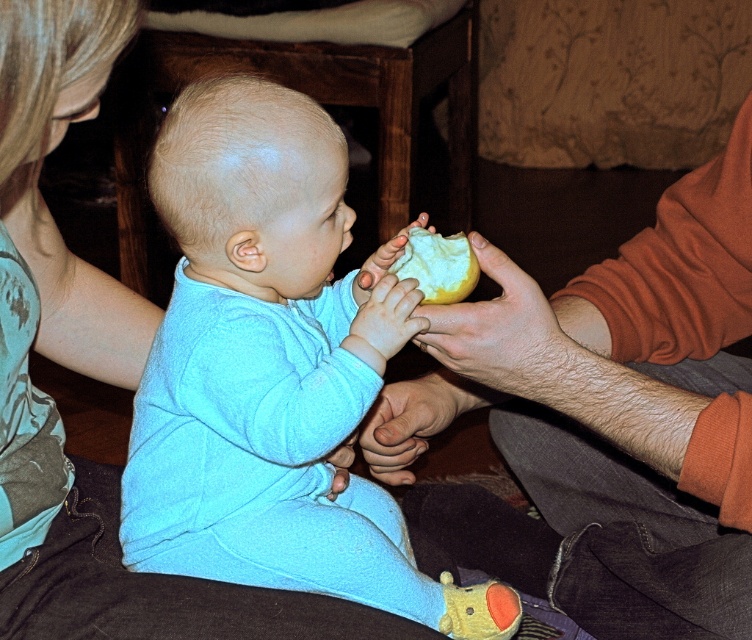
Question: Among these points, which one is nearest to the camera?

Choices:
 (A) (311, 109)
 (B) (432, 257)

Answer: (A)

Question: Estimate the real-world distances between objects in this image. Which object is closer to the yellow matte apple at center?

Choices:
 (A) light blue fleece baby at center
 (B) matte orange sweater at right

Answer: (A)

Question: Which point is closer to the camera?

Choices:
 (A) yellow matte apple at center
 (B) light blue fleece baby at center
 (C) matte orange sweater at right

Answer: (B)

Question: Does matte orange sweater at right appear on the left side of yellow matte apple at center?

Choices:
 (A) yes
 (B) no

Answer: (B)

Question: Can you confirm if matte orange sweater at right is thinner than light blue fleece baby at center?

Choices:
 (A) yes
 (B) no

Answer: (B)

Question: Is matte orange sweater at right smaller than yellow matte apple at center?

Choices:
 (A) no
 (B) yes

Answer: (A)